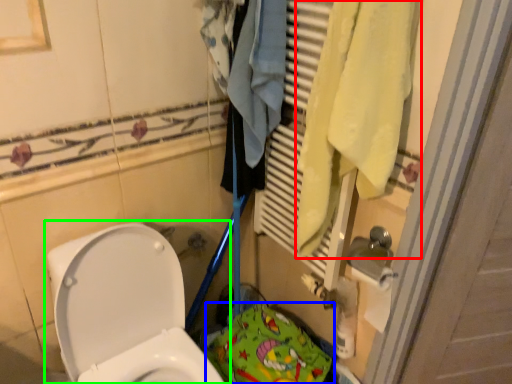
Question: Considering the real-world distances, which object is farthest from bath towel (highlighted by a red box)? material (highlighted by a blue box) or toilet (highlighted by a green box)?

Choices:
 (A) material
 (B) toilet

Answer: (A)